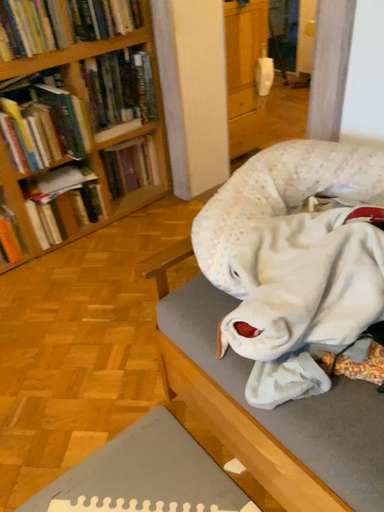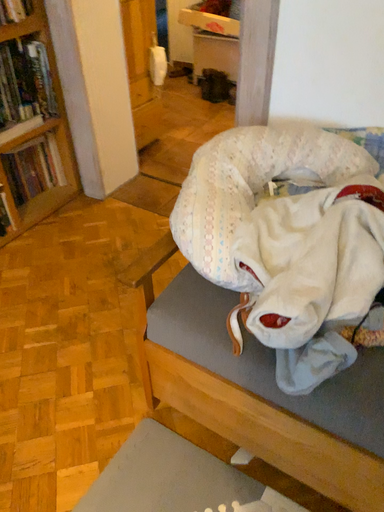
Question: How did the camera likely rotate when shooting the video?

Choices:
 (A) rotated left
 (B) rotated right

Answer: (B)